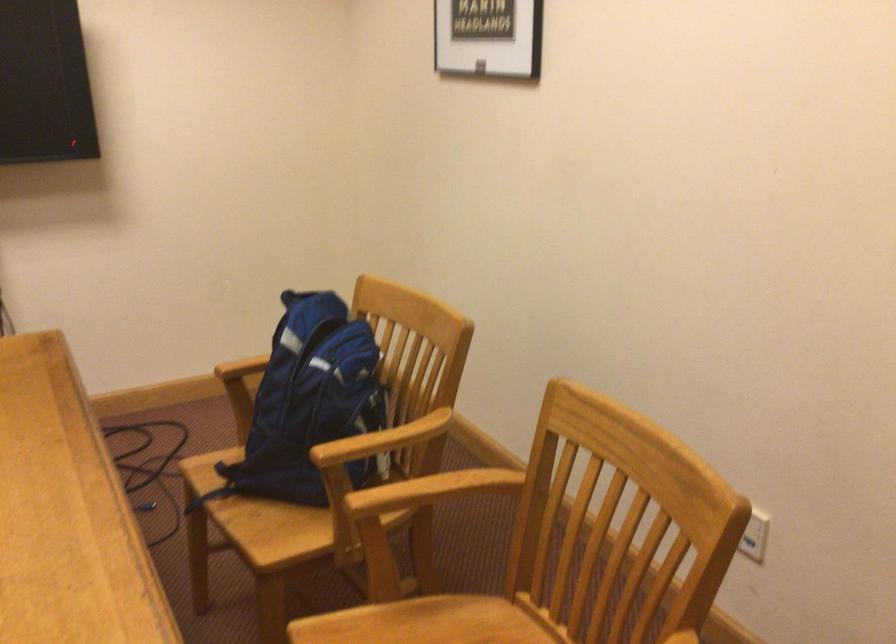
This screenshot has height=644, width=896. I want to click on blue backpack, so click(309, 404).